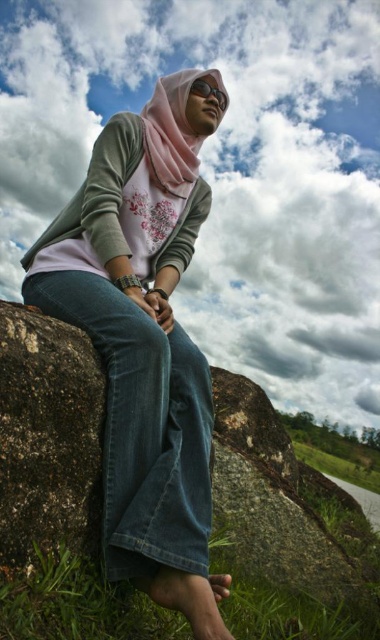
Is rough textured rock at lower right below matte black goggles at upper center?

Indeed, rough textured rock at lower right is positioned under matte black goggles at upper center.

Who is shorter, rough textured rock at lower right or matte black goggles at upper center?

With less height is matte black goggles at upper center.

Locate an element on the screen. The width and height of the screenshot is (380, 640). rough textured rock at lower right is located at coordinates (275, 529).

Locate an element on the screen. This screenshot has width=380, height=640. rough textured rock at lower left is located at coordinates (47, 436).

Does rough textured rock at lower left appear on the right side of matte black goggles at upper center?

Incorrect, rough textured rock at lower left is not on the right side of matte black goggles at upper center.

Is point (25, 445) positioned before point (226, 99)?

That is True.

Identify the location of rough textured rock at lower left. The width and height of the screenshot is (380, 640). (47, 436).

How much distance is there between cloudy sky at upper center and pink satin hijab at upper center?

cloudy sky at upper center and pink satin hijab at upper center are 44.49 meters apart from each other.

Between cloudy sky at upper center and pink satin hijab at upper center, which one has less height?

Standing shorter between the two is pink satin hijab at upper center.

Is point (17, 124) positioned after point (183, 195)?

That is True.

You are a GUI agent. You are given a task and a screenshot of the screen. Output one action in this format:
    pyautogui.click(x=<x>, y=<y>)
    Task: Click on the cloudy sky at upper center
    The height and width of the screenshot is (640, 380).
    Given the screenshot: What is the action you would take?
    pyautogui.click(x=224, y=172)